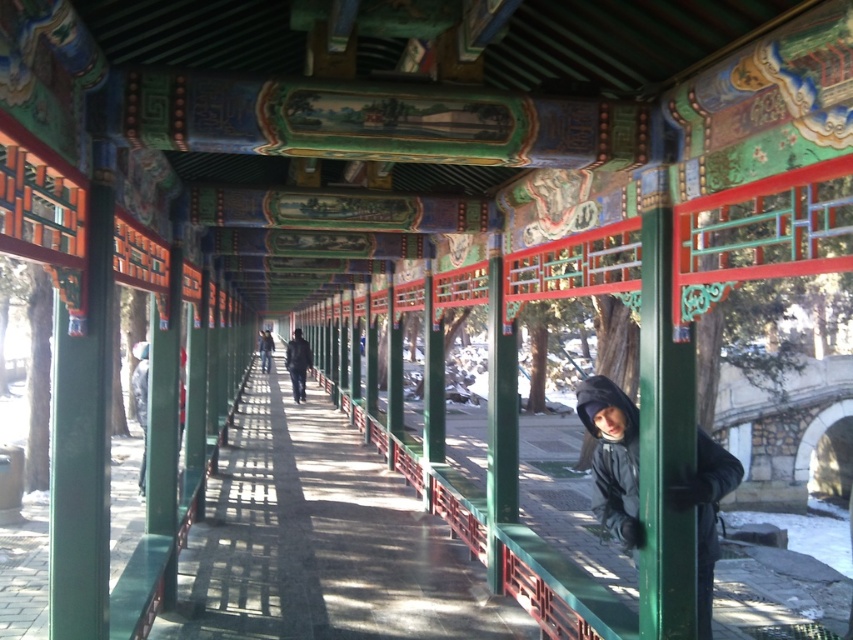
Is point (627, 422) positioned before point (260, 365)?

Yes.

Based on the photo, who is more distant from viewer, (x=724, y=461) or (x=268, y=369)?

The point (x=268, y=369) is more distant.

Is point (724, 477) positioned after point (260, 346)?

No, it is not.

You are a GUI agent. You are given a task and a screenshot of the screen. Output one action in this format:
    pyautogui.click(x=<x>, y=<y>)
    Task: Click on the black matte jacket at center
    The height and width of the screenshot is (640, 853).
    Given the screenshot: What is the action you would take?
    pyautogui.click(x=612, y=456)

Who is positioned more to the right, dark gray jacket at center or dark blue jacket at center?

dark gray jacket at center

Between dark gray jacket at center and dark blue jacket at center, which one has less height?

Standing shorter between the two is dark blue jacket at center.

Which is in front, point (297, 330) or point (265, 344)?

Point (297, 330) is more forward.

Image resolution: width=853 pixels, height=640 pixels. Identify the location of dark gray jacket at center. (297, 364).

In the scene shown: Is black matte jacket at center above dark gray jacket at center?

Incorrect, black matte jacket at center is not positioned above dark gray jacket at center.

Between point (701, 435) and point (292, 385), which one is positioned in front?

Point (701, 435) is in front.

Between point (732, 467) and point (308, 353), which one is positioned in front?

Positioned in front is point (732, 467).

The height and width of the screenshot is (640, 853). In order to click on black matte jacket at center in this screenshot , I will do `click(612, 456)`.